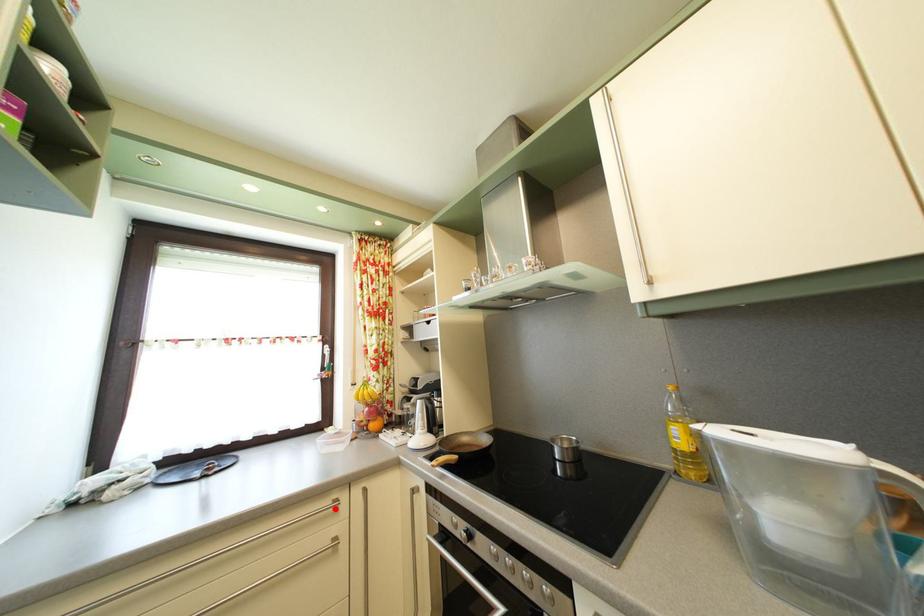
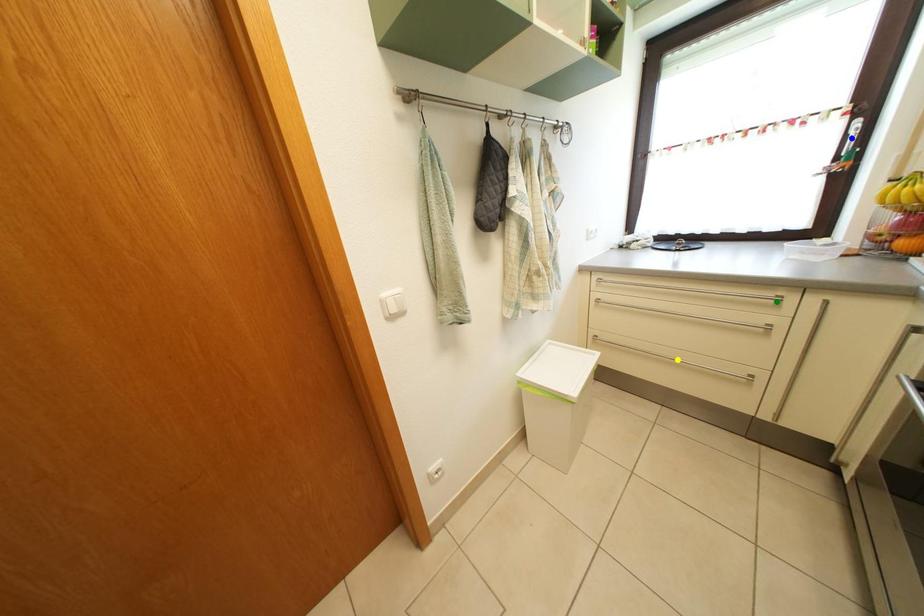
Question: I am providing you with two images of the same scene from different viewpoints. A red point is marked on the first image. You are given multiple points on the second image. Can you choose the point in image 2 that corresponds to the point in image 1?

Choices:
 (A) green point
 (B) blue point
 (C) yellow point

Answer: (A)